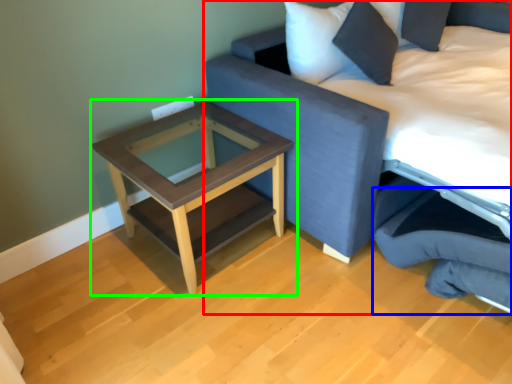
Question: Which object is positioned farthest from studio couch (highlighted by a red box)? Select from swivel chair (highlighted by a blue box) and table (highlighted by a green box).

Choices:
 (A) swivel chair
 (B) table

Answer: (B)